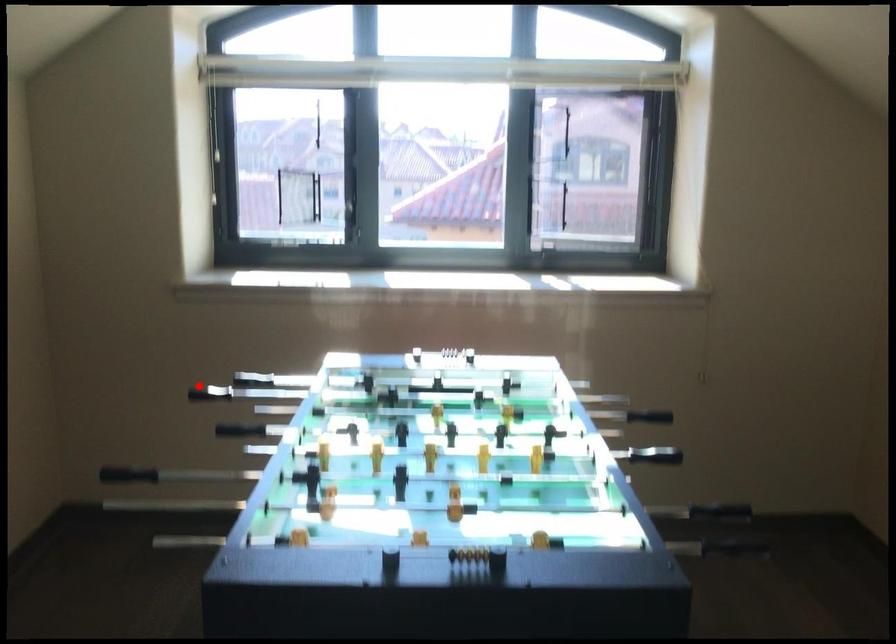
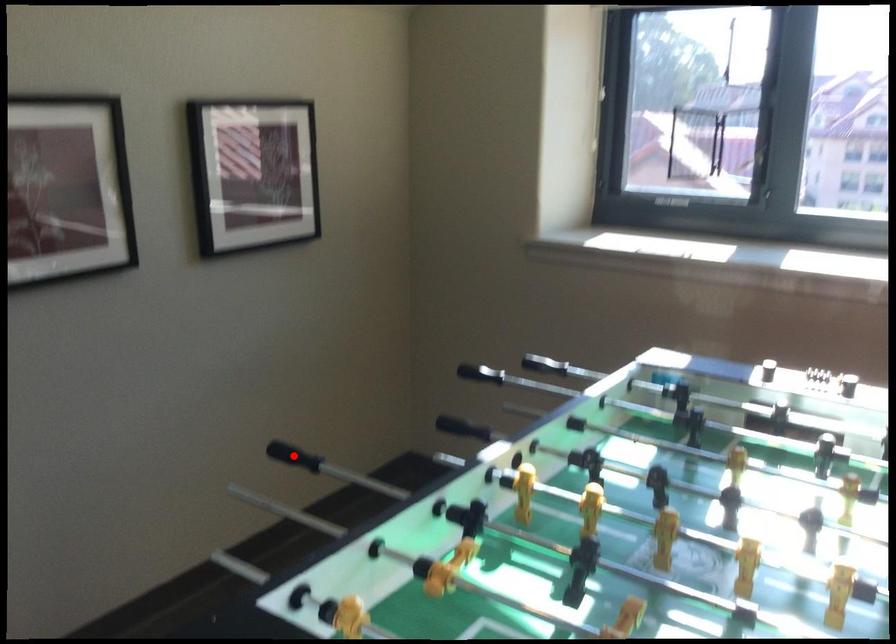
I am providing you with two images of the same scene from different viewpoints. A red point is marked on the first image and another point is marked on the second image. Is the red point in image1 aligned with the point shown in image2?

No